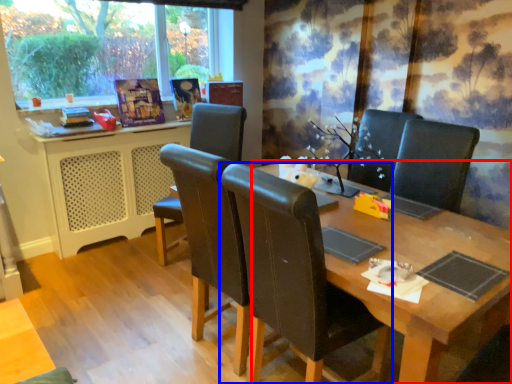
Question: Among these objects, which one is farthest to the camera, table (highlighted by a red box) or chair (highlighted by a blue box)?

Choices:
 (A) table
 (B) chair

Answer: (B)